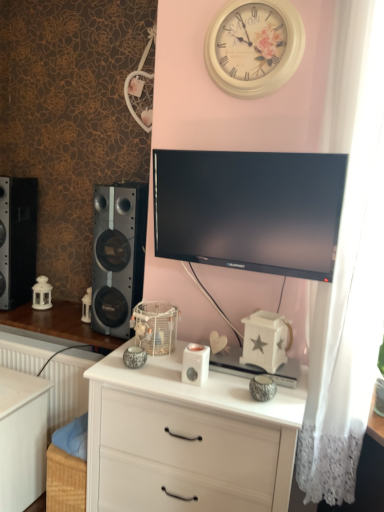
Question: Is white wood changing table at lower left bigger or smaller than black matte speaker at left, the first speaker from the right?

Choices:
 (A) big
 (B) small

Answer: (B)

Question: Considering the positions of white wood changing table at lower left and black matte speaker at left, the 2th speaker when ordered from left to right, in the image, is white wood changing table at lower left wider or thinner than black matte speaker at left, the 2th speaker when ordered from left to right,?

Choices:
 (A) wide
 (B) thin

Answer: (B)

Question: Which of these objects is positioned closest to the black matte speaker at left, the first speaker from the right?

Choices:
 (A) white wood chest of drawers at center
 (B) black glossy tv at center
 (C) black matte speaker at left, acting as the second speaker starting from the right
 (D) wooden table at left
 (E) white lace curtain at right

Answer: (D)

Question: Estimate the real-world distances between objects in this image. Which object is farther from the white wood chest of drawers at center?

Choices:
 (A) black matte speaker at left, the first speaker in the left-to-right sequence
 (B) white wood changing table at lower left
 (C) white wooden clock at upper center
 (D) white plastic ipod at center
 (E) black glossy tv at center

Answer: (A)